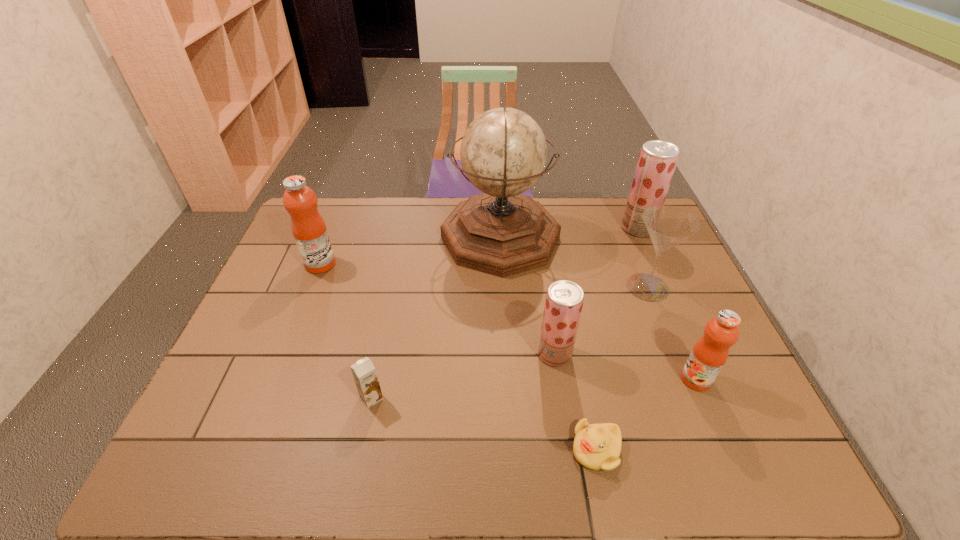
Image resolution: width=960 pixels, height=540 pixels. I want to click on object at the near edge, so click(x=596, y=446).

At what (x,y) coordinates should I click in order to perform the action: click on object that is at the left edge. Please return your answer as a coordinate pair (x, y). Looking at the image, I should click on (309, 230).

You are a GUI agent. You are given a task and a screenshot of the screen. Output one action in this format:
    pyautogui.click(x=<x>, y=<y>)
    Task: Click on the flute glass that is at the right edge
    The image size is (960, 540).
    Given the screenshot: What is the action you would take?
    pyautogui.click(x=668, y=226)

Where is `object that is at the far right corner`? object that is at the far right corner is located at coordinates (657, 160).

This screenshot has height=540, width=960. Identify the location of free point at the far edge. (388, 200).

I want to click on vacant space at the near edge of the desktop, so click(568, 437).

Locate an element on the screen. blank space at the left edge of the desktop is located at coordinates (262, 319).

Where is `vacant region at the right edge of the desktop`? This screenshot has height=540, width=960. vacant region at the right edge of the desktop is located at coordinates (722, 403).

This screenshot has width=960, height=540. In the image, there is a desktop. In order to click on free region at the near left corner in this screenshot , I will do `click(205, 453)`.

Locate an element on the screen. vacant point at the far right corner is located at coordinates (622, 236).